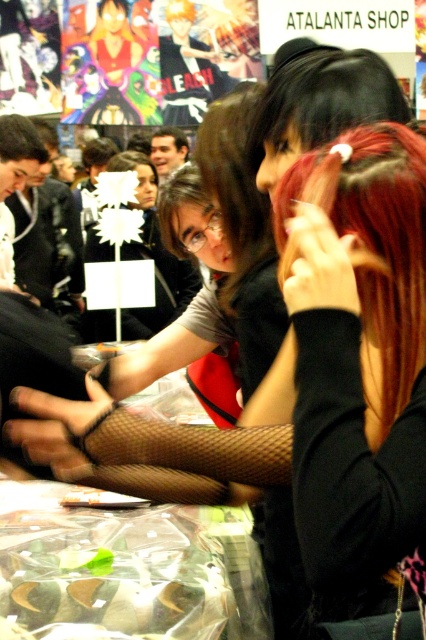
Consider the image. Who is taller, shiny red hair at center or fishnet stockings at center?

Standing taller between the two is shiny red hair at center.

In the scene shown: Is shiny red hair at center to the left of fishnet stockings at center from the viewer's perspective?

In fact, shiny red hair at center is to the right of fishnet stockings at center.

Does point (285, 262) lie behind point (88, 413)?

No, it is not.

This screenshot has height=640, width=426. What are the coordinates of `shiny red hair at center` in the screenshot? It's located at (362, 356).

Looking at this image, which of these two, brownhair at center or dark brown hair at upper left, stands shorter?

Standing shorter between the two is dark brown hair at upper left.

Is brownhair at center shorter than dark brown hair at upper left?

In fact, brownhair at center may be taller than dark brown hair at upper left.

Between point (218, 189) and point (17, 115), which one is positioned behind?

Point (17, 115)

I want to click on brownhair at center, so (x=235, y=184).

Between fishnet stockings at center and brownhair at center, which one is positioned higher?

brownhair at center is higher up.

Measure the distance between fishnet stockings at center and brownhair at center.

17.61 inches

Describe the element at coordinates (147, 451) in the screenshot. I see `fishnet stockings at center` at that location.

Where is `fishnet stockings at center`? The height and width of the screenshot is (640, 426). fishnet stockings at center is located at coordinates (147, 451).